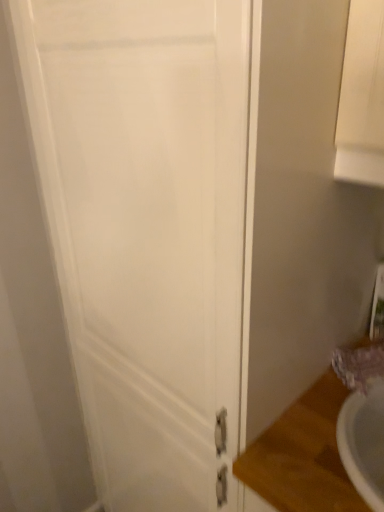
Question: From a real-world perspective, relative to matte purple faucet at lower right, is white matte door at center vertically above or below?

Choices:
 (A) above
 (B) below

Answer: (B)

Question: Is point (150, 42) positioned closer to the camera than point (382, 366)?

Choices:
 (A) farther
 (B) closer

Answer: (B)

Question: Which is nearer to the white matte door at center?

Choices:
 (A) matte purple faucet at lower right
 (B) wooden counter top at lower right

Answer: (B)

Question: Which is nearer to the wooden counter top at lower right?

Choices:
 (A) white matte door at center
 (B) matte purple faucet at lower right

Answer: (B)